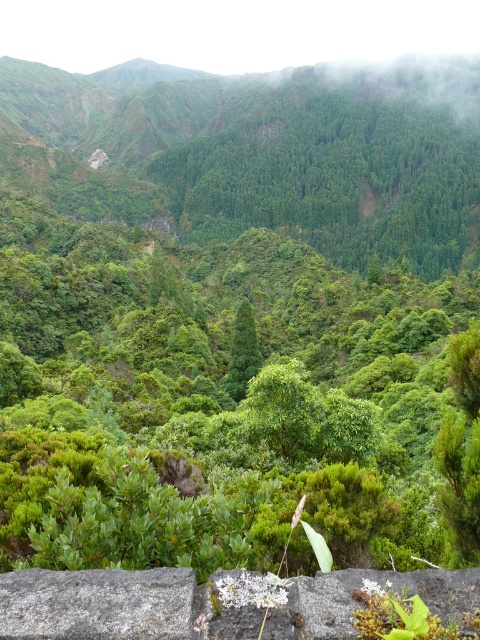
Can you confirm if green leafy trees at center is shorter than gray rough stone at lower left?

In fact, green leafy trees at center may be taller than gray rough stone at lower left.

Between green leafy trees at center and gray rough stone at lower left, which one has less height?

gray rough stone at lower left

Is point (429, 209) positioned in front of point (101, 616)?

That is False.

Find the location of a particular element. Image resolution: width=480 pixels, height=640 pixels. green leafy trees at center is located at coordinates (339, 164).

Consider the image. Is gray rough stone at lower left smaller than green leafy tree at center?

Correct, gray rough stone at lower left occupies less space than green leafy tree at center.

Is gray rough stone at lower left further to the viewer compared to green leafy tree at center?

No, it is not.

Who is more forward, (38, 604) or (256, 337)?

Positioned in front is point (38, 604).

Locate an element on the screen. gray rough stone at lower left is located at coordinates (96, 604).

Does green leafy shrub at center have a larger size compared to green leafy tree at center?

Yes.

Can you confirm if green leafy shrub at center is thinner than green leafy tree at center?

No, green leafy shrub at center is not thinner than green leafy tree at center.

Between point (213, 417) and point (236, 330), which one is positioned behind?

Positioned behind is point (236, 330).

The width and height of the screenshot is (480, 640). What are the coordinates of `green leafy shrub at center` in the screenshot? It's located at (224, 397).